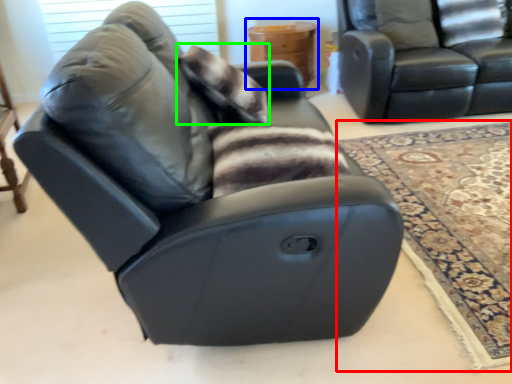
Question: Which is nearer to the mat (highlighted by a red box)? table (highlighted by a blue box) or pillow (highlighted by a green box).

Choices:
 (A) table
 (B) pillow

Answer: (B)